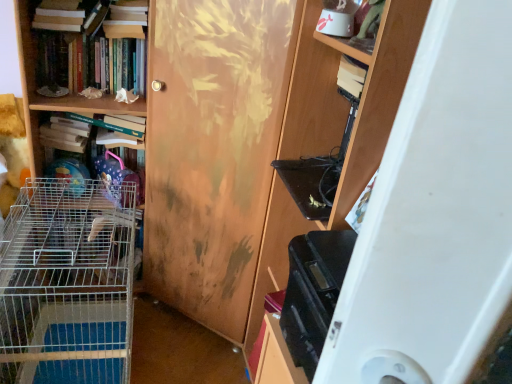
This screenshot has height=384, width=512. Describe the element at coordinates (436, 216) in the screenshot. I see `wooden shelf at right` at that location.

Image resolution: width=512 pixels, height=384 pixels. What do you see at coordinates (213, 149) in the screenshot? I see `wooden door at center` at bounding box center [213, 149].

Describe the element at coordinates (119, 176) in the screenshot. I see `hardcover book at left, the third book in the top-to-bottom sequence` at that location.

Locate an element on the screen. wooden shelf at right is located at coordinates (436, 216).

From a real-world perspective, is matte white book at upper left, positioned as the 3th book in bottom-to-top order, under silver wire cage at left?

Actually, matte white book at upper left, positioned as the 3th book in bottom-to-top order, is physically above silver wire cage at left in the real world.

Consider the image. Considering the relative sizes of matte white book at upper left, which appears as the first book when viewed from the top, and silver wire cage at left in the image provided, is matte white book at upper left, which appears as the first book when viewed from the top, shorter than silver wire cage at left?

Indeed, matte white book at upper left, which appears as the first book when viewed from the top, has a lesser height compared to silver wire cage at left.

In terms of width, does matte white book at upper left, which appears as the first book when viewed from the top, look wider or thinner when compared to silver wire cage at left?

matte white book at upper left, which appears as the first book when viewed from the top, is thinner than silver wire cage at left.

Which object is further away from the camera, matte white book at upper left, positioned as the 3th book in bottom-to-top order, or silver wire cage at left?

matte white book at upper left, positioned as the 3th book in bottom-to-top order, is further away from the camera.

Can you confirm if silver wire cage at left is positioned to the right of hardcover book at left, which is counted as the 1th book, starting from the bottom?

Yes.

The height and width of the screenshot is (384, 512). What are the coordinates of `wheel below the hardcover book at left, which is counted as the 1th book, starting from the bottom (from the image's perspective)` in the screenshot? It's located at (67, 284).

Is point (76, 254) behind point (108, 168)?

That is False.

Is silver wire cage at left positioned beyond the bounds of hardcover book at left, the third book in the top-to-bottom sequence?

Yes, silver wire cage at left is outside of hardcover book at left, the third book in the top-to-bottom sequence.

Which of these two, matte white book at upper left, which appears as the first book when viewed from the top, or hardcover book at left, the third book in the top-to-bottom sequence, is thinner?

A: With smaller width is matte white book at upper left, which appears as the first book when viewed from the top.

From the image's perspective, is matte white book at upper left, positioned as the 3th book in bottom-to-top order, located above or below hardcover book at left, the third book in the top-to-bottom sequence?

matte white book at upper left, positioned as the 3th book in bottom-to-top order, is above hardcover book at left, the third book in the top-to-bottom sequence.

Measure the distance from matte white book at upper left, which appears as the first book when viewed from the top, to hardcover book at left, which is counted as the 1th book, starting from the bottom.

A distance of 16.50 inches exists between matte white book at upper left, which appears as the first book when viewed from the top, and hardcover book at left, which is counted as the 1th book, starting from the bottom.

From a real-world perspective, does metal wire cage at left stand above wooden shelf at right?

Incorrect, from a real-world perspective, metal wire cage at left is lower than wooden shelf at right.

The width and height of the screenshot is (512, 384). In order to click on wide that appears on the right of metal wire cage at left in this screenshot , I will do `click(436, 216)`.

Is metal wire cage at left oriented away from wooden shelf at right?

That's not correct — metal wire cage at left is not looking away from wooden shelf at right.

From a real-world perspective, between wooden shelf at right and hardcover book at left, the third book in the top-to-bottom sequence, who is vertically lower?

From a 3D spatial view, hardcover book at left, the third book in the top-to-bottom sequence, is below.

Is wooden shelf at right facing away from hardcover book at left, the third book in the top-to-bottom sequence?

No, wooden shelf at right is not facing the opposite direction of hardcover book at left, the third book in the top-to-bottom sequence.

Is wooden shelf at right surrounding hardcover book at left, the third book in the top-to-bottom sequence?

No, hardcover book at left, the third book in the top-to-bottom sequence, is not a part of wooden shelf at right.

Is point (392, 288) less distant than point (42, 26)?

Yes, it is in front of point (42, 26).

In the image, is wooden shelf at right on the left side or the right side of matte white book at upper left, which appears as the first book when viewed from the top?

From the image, it's evident that wooden shelf at right is to the right of matte white book at upper left, which appears as the first book when viewed from the top.

Consider the image. Looking at the image, does wooden shelf at right seem bigger or smaller compared to matte white book at upper left, positioned as the 3th book in bottom-to-top order?

wooden shelf at right is bigger than matte white book at upper left, positioned as the 3th book in bottom-to-top order.

Is matte white book at upper left, which appears as the first book when viewed from the top, surrounded by wooden shelf at right?

No.

Consider the image. From the image's perspective, relative to silver wire cage at left, is wooden door at center above or below?

Clearly, from the image's perspective, wooden door at center is above silver wire cage at left.

Based on the photo, what's the angular difference between wooden door at center and silver wire cage at left's facing directions?

wooden door at center and silver wire cage at left are facing 40.9 degrees away from each other.

Does point (163, 17) come farther from viewer compared to point (78, 361)?

That is False.

Is there a large distance between wooden door at center and silver wire cage at left?

wooden door at center is actually quite close to silver wire cage at left.

This screenshot has width=512, height=384. I want to click on the 3rd book positioned above the silver wire cage at left (from a real-world perspective), so click(59, 16).

Where is `wheel on the right of hardcover book at left, the third book in the top-to-bottom sequence`? The width and height of the screenshot is (512, 384). wheel on the right of hardcover book at left, the third book in the top-to-bottom sequence is located at coordinates (67, 284).

Based on their spatial positions, is wooden shelf at right or hardcover books at upper left, positioned as the 2th book in bottom-to-top order, further from hardcover book at left, the third book in the top-to-bottom sequence?

The object further to hardcover book at left, the third book in the top-to-bottom sequence, is wooden shelf at right.

Looking at the image, which one is located closer to silver wire cage at left, metal wire cage at left or wooden shelf at right?

Among the two, metal wire cage at left is located nearer to silver wire cage at left.

Considering their positions, is silver wire cage at left positioned closer to metal wire cage at left than hardcover book at left, which is counted as the 1th book, starting from the bottom?

The object closer to metal wire cage at left is hardcover book at left, which is counted as the 1th book, starting from the bottom.

From the image, which object appears to be farther from wooden door at center, metal wire cage at left or wooden shelf at right?

Among the two, wooden shelf at right is located further to wooden door at center.

Estimate the real-world distances between objects in this image. Which object is further from silver wire cage at left, wooden door at center or metal wire cage at left?

metal wire cage at left.

Consider the image. Based on their spatial positions, is wooden door at center or matte white book at upper left, which appears as the first book when viewed from the top, further from silver wire cage at left?

matte white book at upper left, which appears as the first book when viewed from the top.

Looking at the image, which one is located closer to wooden shelf at right, hardcover book at left, which is counted as the 1th book, starting from the bottom, or metal wire cage at left?

Among the two, hardcover book at left, which is counted as the 1th book, starting from the bottom, is located nearer to wooden shelf at right.

Based on their spatial positions, is metal wire cage at left or wooden door at center further from silver wire cage at left?

metal wire cage at left is further to silver wire cage at left.

Locate an element on the screen. This screenshot has width=512, height=384. door between hardcover books at upper left, which is the 2th book from top to bottom, and silver wire cage at left from top to bottom is located at coordinates (213, 149).

I want to click on shelf between matte white book at upper left, which appears as the first book when viewed from the top, and silver wire cage at left from top to bottom, so click(47, 98).

Find the location of a particular element. door that lies between matte white book at upper left, which appears as the first book when viewed from the top, and silver wire cage at left from top to bottom is located at coordinates (213, 149).

Locate an element on the screen. Image resolution: width=512 pixels, height=384 pixels. door between hardcover book at left, which is counted as the 1th book, starting from the bottom, and wooden shelf at right is located at coordinates [213, 149].